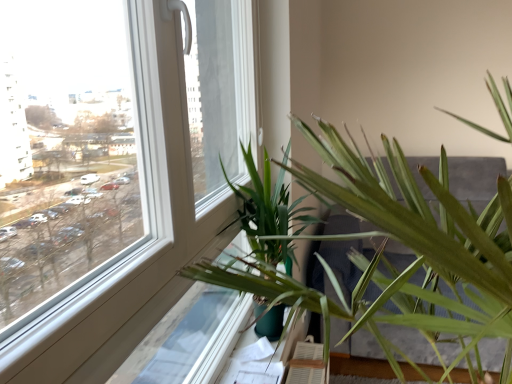
Question: From their relative heights in the image, would you say green leafy palm at center is taller or shorter than green plastic at lower center?

Choices:
 (A) tall
 (B) short

Answer: (A)

Question: Is green leafy palm at center bigger or smaller than green plastic at lower center?

Choices:
 (A) big
 (B) small

Answer: (A)

Question: Based on their relative distances, which object is farther from the green matte plant at lower center?

Choices:
 (A) green plastic at lower center
 (B) green leafy palm at center

Answer: (A)

Question: Which of these objects is positioned closest to the green leafy palm at center?

Choices:
 (A) green plastic at lower center
 (B) green matte plant at lower center

Answer: (B)